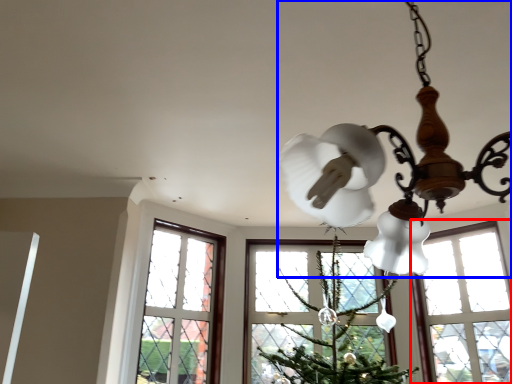
Question: Among these objects, which one is farthest to the camera, window (highlighted by a red box) or lamp (highlighted by a blue box)?

Choices:
 (A) window
 (B) lamp

Answer: (A)